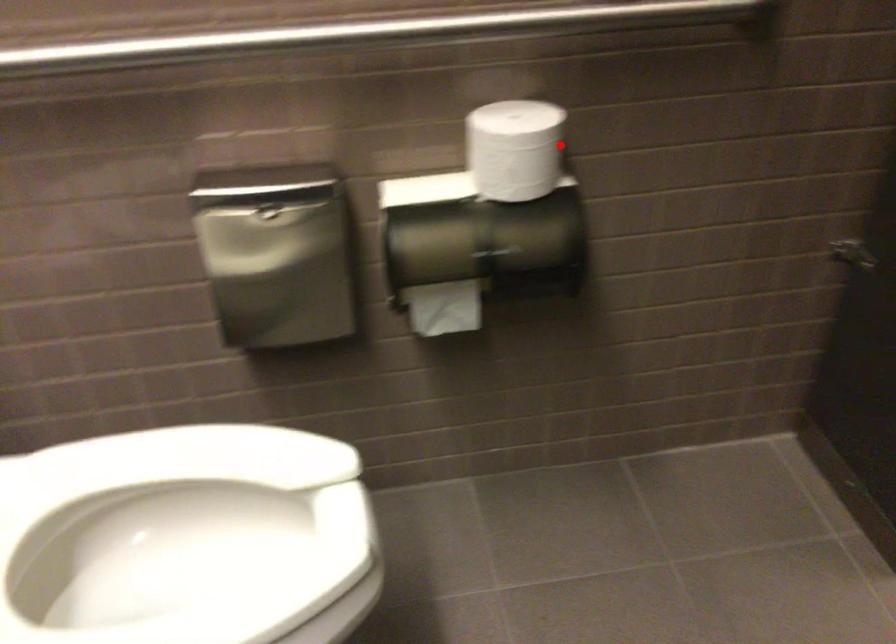
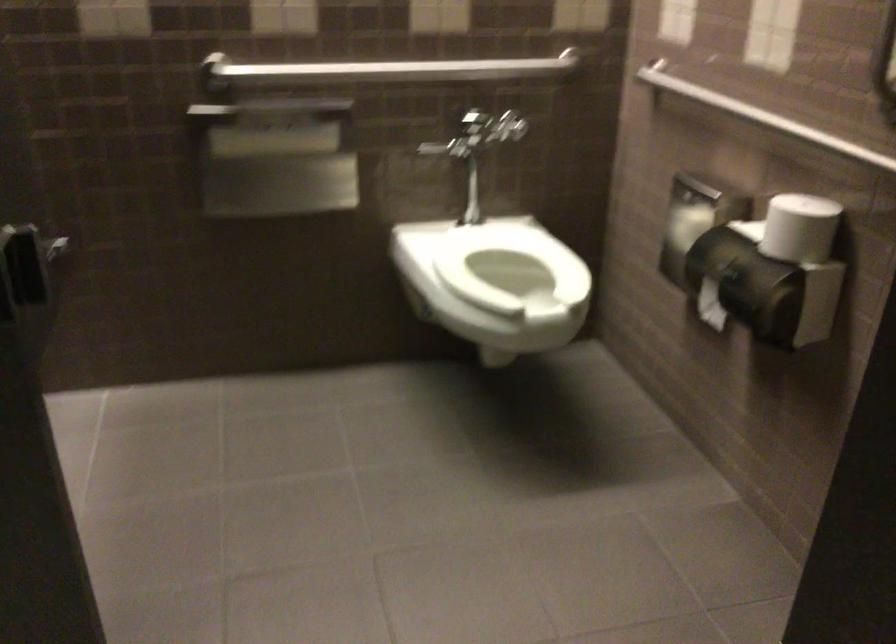
In the second image, find the point that corresponds to the highlighted location in the first image.

(799, 228)